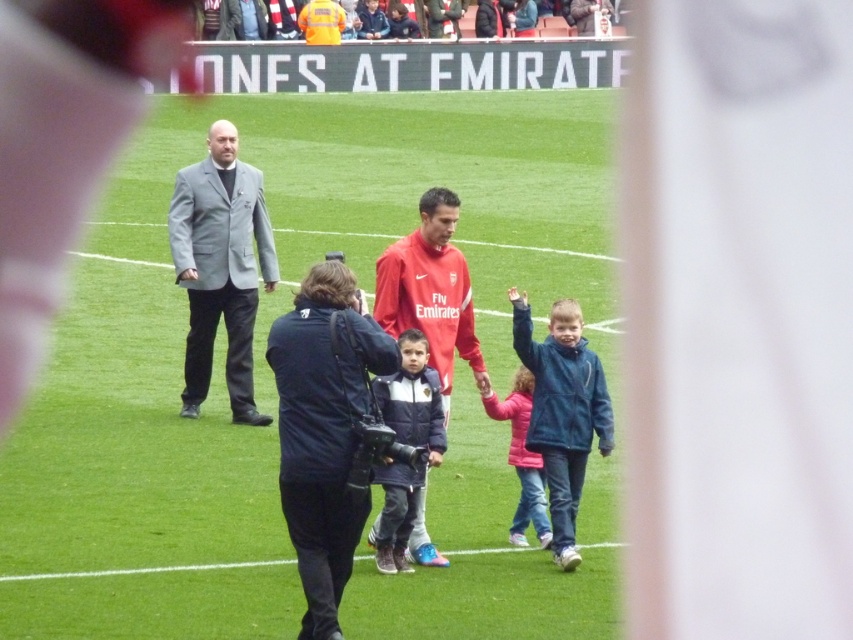
Question: Can you confirm if blue fleece jacket at center is smaller than red matte jersey at center?

Choices:
 (A) no
 (B) yes

Answer: (B)

Question: Considering the real-world distances, which object is farthest from the pink fleece jacket at center?

Choices:
 (A) gray wool suit at center
 (B) green grass field at center
 (C) dark blue padded jacket at center
 (D) blue fleece jacket at center

Answer: (B)

Question: Which point is closer to the camera?

Choices:
 (A) red matte jersey at center
 (B) pink fleece jacket at center
 (C) dark blue padded jacket at center
 (D) black fabric camera at center

Answer: (D)

Question: Which point appears farthest from the camera in this image?

Choices:
 (A) (572, 364)
 (B) (613, 342)
 (C) (378, 269)

Answer: (B)

Question: Is black fabric camera at center below blue fleece jacket at center?

Choices:
 (A) no
 (B) yes

Answer: (B)

Question: Does gray wool suit at center lie behind red matte jersey at center?

Choices:
 (A) no
 (B) yes

Answer: (B)